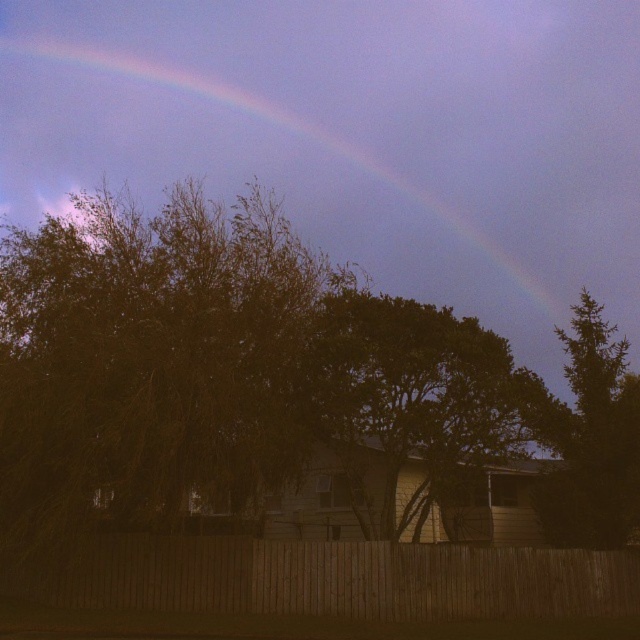
You are standing in the evening scene and see two points in the sky. The first point is at coordinates point (499,342) and the second is at point (548,500). Which point is closer to you?

Point (499,342) is in front of point (548,500), so it is closer to you.

You are an artist trying to paint the scene. You want to ensure the rainbow at upper center and the green leafy tree at upper right are proportionally accurate. Which object should you paint taller?

The rainbow at upper center should be painted taller because it has a greater height compared to the green leafy tree at upper right.

You are an artist painting the evening scene. You need to place the wooden fence at lower center and the green leafy tree at upper right in your painting. Based on the scene description, which object should you paint first to ensure proper layering?

You should paint the green leafy tree at upper right first because the wooden fence at lower center is located below it, meaning the fence will be in front and require layering over the tree.